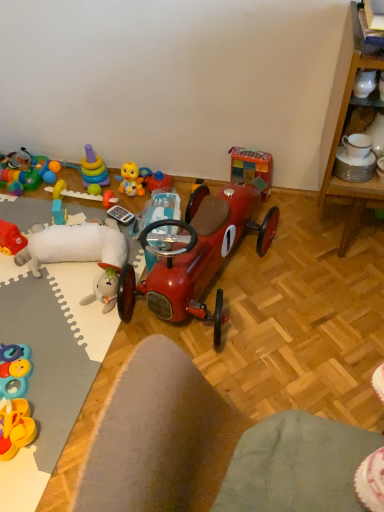
Where is `vacant area that lies between wooden cabinet at right and shiny red car at center, which is the 10th toy in left-to-right order`? This screenshot has height=512, width=384. vacant area that lies between wooden cabinet at right and shiny red car at center, which is the 10th toy in left-to-right order is located at coordinates (303, 279).